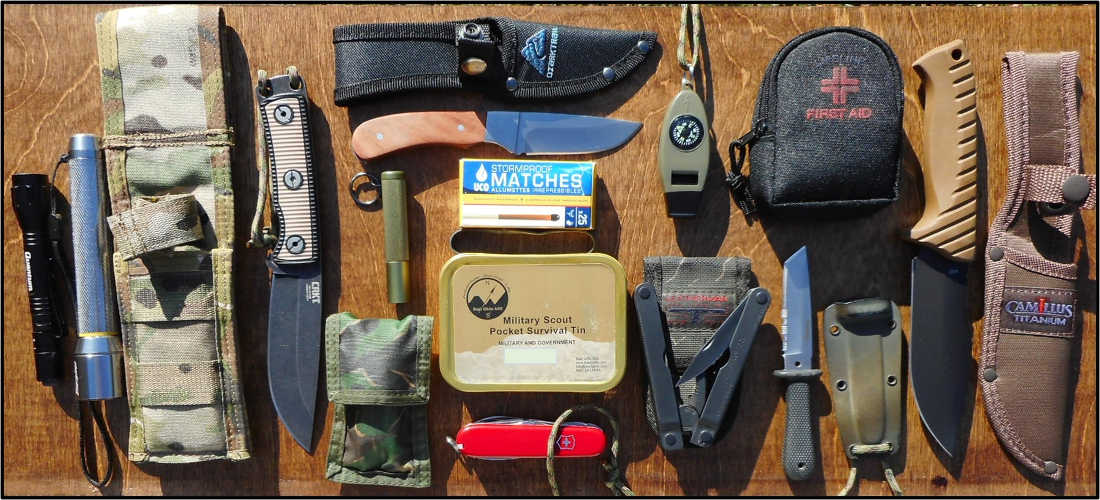
Find the location of a particular element. The width and height of the screenshot is (1100, 500). wooden surface is located at coordinates (48, 476).